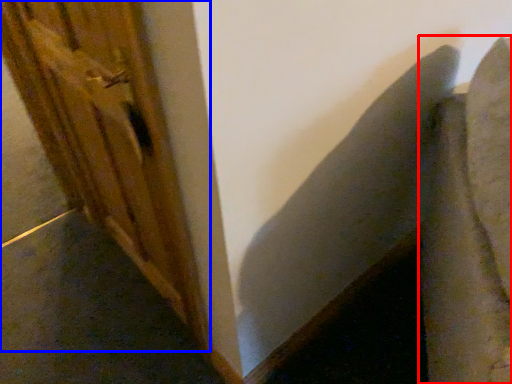
Question: Which object appears farthest to the camera in this image, swivel chair (highlighted by a red box) or barn door (highlighted by a blue box)?

Choices:
 (A) swivel chair
 (B) barn door

Answer: (B)